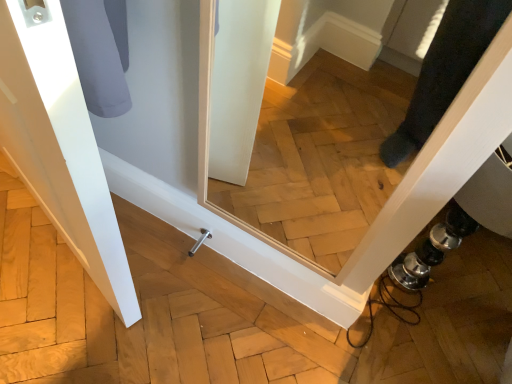
Question: Does satin nickel door handle at lower center have a greater width compared to white matte door at left?

Choices:
 (A) yes
 (B) no

Answer: (B)

Question: Can you confirm if satin nickel door handle at lower center is taller than white matte door at left?

Choices:
 (A) no
 (B) yes

Answer: (A)

Question: Is satin nickel door handle at lower center positioned beyond the bounds of white matte door at left?

Choices:
 (A) yes
 (B) no

Answer: (A)

Question: Is satin nickel door handle at lower center at the right side of white matte door at left?

Choices:
 (A) yes
 (B) no

Answer: (A)

Question: Does satin nickel door handle at lower center come in front of white matte door at left?

Choices:
 (A) no
 (B) yes

Answer: (A)

Question: Is satin nickel door handle at lower center to the left of white matte door at left from the viewer's perspective?

Choices:
 (A) yes
 (B) no

Answer: (B)

Question: Is white matte door at left not close to satin nickel door handle at lower center?

Choices:
 (A) yes
 (B) no

Answer: (B)

Question: From a real-world perspective, does white matte door at left sit lower than satin nickel door handle at lower center?

Choices:
 (A) no
 (B) yes

Answer: (A)

Question: Can you confirm if white matte door at left is shorter than satin nickel door handle at lower center?

Choices:
 (A) yes
 (B) no

Answer: (B)

Question: Is white matte door at left bigger than satin nickel door handle at lower center?

Choices:
 (A) no
 (B) yes

Answer: (B)

Question: Considering the relative positions of white matte door at left and satin nickel door handle at lower center in the image provided, is white matte door at left to the right of satin nickel door handle at lower center from the viewer's perspective?

Choices:
 (A) yes
 (B) no

Answer: (B)

Question: Does white matte door at left lie in front of satin nickel door handle at lower center?

Choices:
 (A) yes
 (B) no

Answer: (A)

Question: From their relative heights in the image, would you say satin nickel door handle at lower center is taller or shorter than white matte door at left?

Choices:
 (A) tall
 (B) short

Answer: (B)